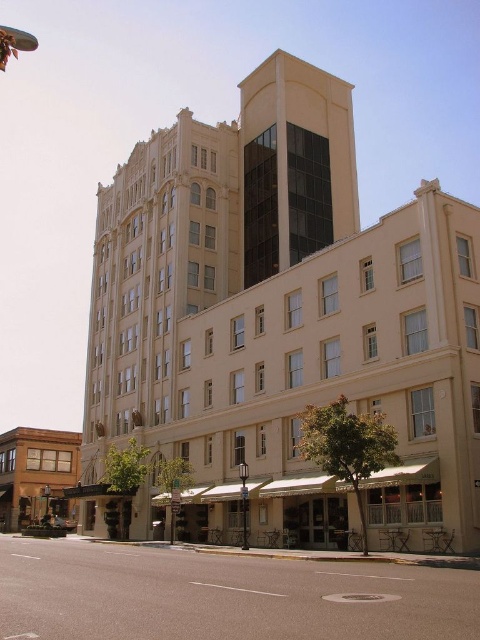
Question: Among these objects, which one is farthest from the camera?

Choices:
 (A) beige stone building at center
 (B) brown wooden building at lower left

Answer: (B)

Question: From the image, what is the correct spatial relationship of beige stone building at center in relation to brown wooden building at lower left?

Choices:
 (A) left
 (B) right

Answer: (B)

Question: Is beige stone building at center below brown wooden building at lower left?

Choices:
 (A) yes
 (B) no

Answer: (B)

Question: Which of the following is the closest to the observer?

Choices:
 (A) (12, 493)
 (B) (141, 380)

Answer: (B)

Question: Is beige stone building at center below brown wooden building at lower left?

Choices:
 (A) yes
 (B) no

Answer: (B)

Question: Which point appears closest to the camera in this image?

Choices:
 (A) click(72, 449)
 (B) click(226, 198)

Answer: (B)